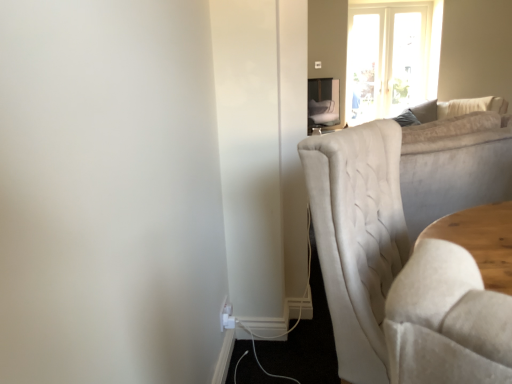
What are the coordinates of `suede-like beige chair at right` in the screenshot? It's located at (396, 273).

Image resolution: width=512 pixels, height=384 pixels. Describe the element at coordinates (396, 273) in the screenshot. I see `suede-like beige chair at right` at that location.

Identify the location of suede-like beige chair at right. This screenshot has width=512, height=384. (396, 273).